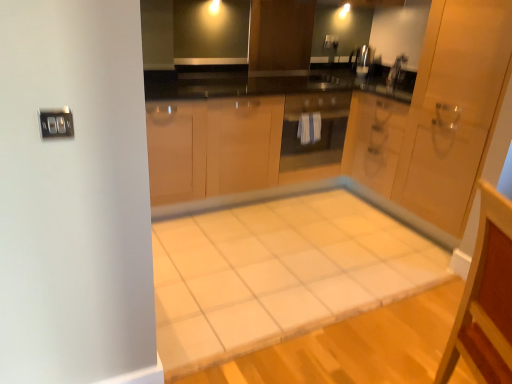
The height and width of the screenshot is (384, 512). What do you see at coordinates (486, 299) in the screenshot?
I see `white tile vanity at lower right` at bounding box center [486, 299].

This screenshot has height=384, width=512. Find the location of `matte glass oven at center`. matte glass oven at center is located at coordinates (313, 130).

Where is `satin nickel faucet at upper center`? This screenshot has height=384, width=512. satin nickel faucet at upper center is located at coordinates (396, 73).

You are a GUI agent. You are given a task and a screenshot of the screen. Output one action in this format:
    pyautogui.click(x=<x>, y=<y>)
    Task: Click on the white tile vanity at lower right
    This screenshot has width=512, height=384.
    Given the screenshot: What is the action you would take?
    pyautogui.click(x=486, y=299)

From the image's perspective, does matte glass oven at center appear lower than satin nickel faucet at upper center?

Yes, from the image's perspective, matte glass oven at center is beneath satin nickel faucet at upper center.

Which object is further away from the camera taking this photo, matte glass oven at center or satin nickel faucet at upper center?

Positioned behind is satin nickel faucet at upper center.

Does point (300, 107) come in front of point (398, 69)?

Yes.

Considering the sizes of objects white tile vanity at lower right and wooden door at right in the image provided, who is smaller, white tile vanity at lower right or wooden door at right?

white tile vanity at lower right is smaller.

Is white tile vanity at lower right next to wooden door at right and touching it?

white tile vanity at lower right is not next to wooden door at right, and they're not touching.

Is white tile vanity at lower right facing towards wooden door at right?

No, white tile vanity at lower right does not turn towards wooden door at right.

From a real-world perspective, relative to wooden door at right, is white tile vanity at lower right vertically above or below?

From a real-world perspective, white tile vanity at lower right is physically below wooden door at right.

Would you say wooden door at right is outside white tile vanity at lower right?

wooden door at right is positioned outside white tile vanity at lower right.

From the image's perspective, is wooden door at right below white tile vanity at lower right?

Actually, wooden door at right appears above white tile vanity at lower right in the image.

Is wooden door at right facing away from white tile vanity at lower right?

No.

Can you confirm if wooden door at right is bigger than white tile vanity at lower right?

Indeed, wooden door at right has a larger size compared to white tile vanity at lower right.

Between point (459, 180) and point (400, 79), which one is positioned behind?

The point (400, 79) is farther.

From the image's perspective, would you say wooden door at right is shown under satin nickel faucet at upper center?

Yes, from the image's perspective, wooden door at right is below satin nickel faucet at upper center.

Could you tell me if wooden door at right is facing satin nickel faucet at upper center?

No, wooden door at right does not turn towards satin nickel faucet at upper center.

In the scene shown: Which is more to the right, wooden door at right or satin nickel faucet at upper center?

From the viewer's perspective, wooden door at right appears more on the right side.

Relative to satin nickel faucet at upper center, is white tile vanity at lower right in front or behind?

white tile vanity at lower right is positioned closer to the viewer than satin nickel faucet at upper center.

From a real-world perspective, is white tile vanity at lower right beneath satin nickel faucet at upper center?

Yes.

From the image's perspective, who appears lower, white tile vanity at lower right or satin nickel faucet at upper center?

→ white tile vanity at lower right.

Between satin nickel faucet at upper center and white tile table at center, which one appears on the left side from the viewer's perspective?

white tile table at center.

In the scene shown: Is satin nickel faucet at upper center outside of white tile table at center?

That's correct, satin nickel faucet at upper center is outside of white tile table at center.

From the image's perspective, which object appears higher, satin nickel faucet at upper center or white tile table at center?

satin nickel faucet at upper center.

Considering the sizes of objects satin nickel faucet at upper center and white tile table at center in the image provided, who is wider, satin nickel faucet at upper center or white tile table at center?

white tile table at center is wider.

Which object is further away from the camera, white tile table at center or white tile vanity at lower right?

white tile table at center is more distant.

Between white tile table at center and white tile vanity at lower right, which one appears on the left side from the viewer's perspective?

Positioned to the left is white tile table at center.

Find the location of a particular element. This screenshot has height=384, width=512. table that appears behind the white tile vanity at lower right is located at coordinates 282,266.

Does white tile table at center have a greater width compared to white tile vanity at lower right?

Correct, the width of white tile table at center exceeds that of white tile vanity at lower right.

This screenshot has width=512, height=384. I want to click on faucet behind the matte glass oven at center, so click(x=396, y=73).

Identify the location of vanity on the left of wooden door at right. (486, 299).

When comparing their distances from matte glass oven at center, does wooden door at right or white tile vanity at lower right seem closer?

The object closer to matte glass oven at center is wooden door at right.

Based on their spatial positions, is wooden door at right or white tile vanity at lower right further from white tile table at center?

white tile vanity at lower right.

Considering their positions, is wooden door at right positioned further to white tile vanity at lower right than matte glass oven at center?

Among the two, matte glass oven at center is located further to white tile vanity at lower right.

From the picture: Which object lies further to the anchor point wooden door at right, matte glass oven at center or white tile vanity at lower right?

white tile vanity at lower right lies further to wooden door at right than the other object.

When comparing their distances from matte glass oven at center, does satin nickel faucet at upper center or white tile table at center seem closer?

white tile table at center is positioned closer to the anchor matte glass oven at center.

Estimate the real-world distances between objects in this image. Which object is further from white tile table at center, white tile vanity at lower right or matte glass oven at center?

white tile vanity at lower right lies further to white tile table at center than the other object.

Considering their positions, is satin nickel faucet at upper center positioned further to white tile table at center than matte glass oven at center?

satin nickel faucet at upper center is positioned further to the anchor white tile table at center.

Looking at the image, which one is located further to white tile table at center, wooden door at right or satin nickel faucet at upper center?

satin nickel faucet at upper center is further to white tile table at center.

Locate an element on the screen. Image resolution: width=512 pixels, height=384 pixels. table located between white tile vanity at lower right and matte glass oven at center in the depth direction is located at coordinates (282, 266).

Where is `oven located between white tile table at center and satin nickel faucet at upper center in the depth direction`? The height and width of the screenshot is (384, 512). oven located between white tile table at center and satin nickel faucet at upper center in the depth direction is located at coordinates (313, 130).

Image resolution: width=512 pixels, height=384 pixels. I want to click on oven positioned between wooden door at right and satin nickel faucet at upper center from near to far, so click(x=313, y=130).

You are a GUI agent. You are given a task and a screenshot of the screen. Output one action in this format:
    pyautogui.click(x=<x>, y=<y>)
    Task: Click on the door positioned between white tile table at center and satin nickel faucet at upper center from near to far
    This screenshot has width=512, height=384.
    Given the screenshot: What is the action you would take?
    pyautogui.click(x=453, y=107)